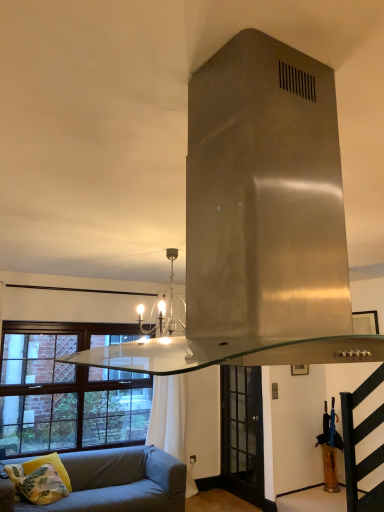
Question: From the image's perspective, does light blue fabric studio couch at lower left appear higher than matte black chandelier at center?

Choices:
 (A) yes
 (B) no

Answer: (B)

Question: From the image's perspective, is light blue fabric studio couch at lower left beneath matte black chandelier at center?

Choices:
 (A) yes
 (B) no

Answer: (A)

Question: Is light blue fabric studio couch at lower left oriented away from matte black chandelier at center?

Choices:
 (A) yes
 (B) no

Answer: (B)

Question: Does light blue fabric studio couch at lower left have a smaller size compared to matte black chandelier at center?

Choices:
 (A) no
 (B) yes

Answer: (A)

Question: Could you tell me if light blue fabric studio couch at lower left is facing matte black chandelier at center?

Choices:
 (A) yes
 (B) no

Answer: (B)

Question: Is matte black chandelier at center taller or shorter than clear glass door at center?

Choices:
 (A) short
 (B) tall

Answer: (A)

Question: Based on their sizes in the image, would you say matte black chandelier at center is bigger or smaller than clear glass door at center?

Choices:
 (A) big
 (B) small

Answer: (A)

Question: Is matte black chandelier at center in front of or behind clear glass door at center in the image?

Choices:
 (A) behind
 (B) front

Answer: (B)

Question: Is matte black chandelier at center to the left or to the right of clear glass door at center in the image?

Choices:
 (A) left
 (B) right

Answer: (A)

Question: In terms of width, does light blue fabric studio couch at lower left look wider or thinner when compared to brown wooden window at lower left?

Choices:
 (A) wide
 (B) thin

Answer: (A)

Question: In terms of size, does light blue fabric studio couch at lower left appear bigger or smaller than brown wooden window at lower left?

Choices:
 (A) small
 (B) big

Answer: (B)

Question: In the image, is light blue fabric studio couch at lower left positioned in front of or behind brown wooden window at lower left?

Choices:
 (A) behind
 (B) front

Answer: (B)

Question: Choose the correct answer: Is light blue fabric studio couch at lower left inside brown wooden window at lower left or outside it?

Choices:
 (A) outside
 (B) inside

Answer: (A)

Question: Considering the positions of point (221, 410) and point (38, 466), is point (221, 410) closer or farther from the camera than point (38, 466)?

Choices:
 (A) closer
 (B) farther

Answer: (B)

Question: Is clear glass door at center spatially inside yellow fabric pillow at lower left, arranged as the second pillow when viewed from the left, or outside of it?

Choices:
 (A) outside
 (B) inside

Answer: (A)